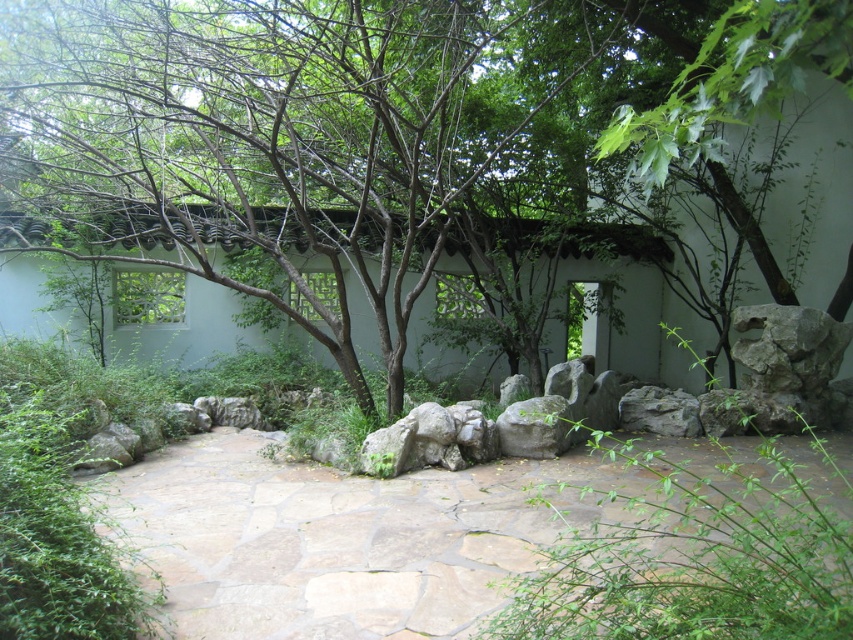
Does green leafy tree at center have a lesser width compared to gray rough rock at right?

Incorrect, green leafy tree at center's width is not less than gray rough rock at right's.

Does green leafy tree at center have a smaller size compared to gray rough rock at right?

No.

You are a GUI agent. You are given a task and a screenshot of the screen. Output one action in this format:
    pyautogui.click(x=<x>, y=<y>)
    Task: Click on the green leafy tree at center
    This screenshot has width=853, height=640.
    Given the screenshot: What is the action you would take?
    pyautogui.click(x=277, y=131)

You are a GUI agent. You are given a task and a screenshot of the screen. Output one action in this format:
    pyautogui.click(x=<x>, y=<y>)
    Task: Click on the green leafy tree at center
    The height and width of the screenshot is (640, 853).
    Given the screenshot: What is the action you would take?
    (277, 131)

Can you confirm if natural stone path at center is positioned below gray rough rock at center?

Yes.

Does natural stone path at center have a lesser height compared to gray rough rock at center?

Indeed, natural stone path at center has a lesser height compared to gray rough rock at center.

Is point (289, 502) closer to camera compared to point (621, 420)?

Yes, it is.

Image resolution: width=853 pixels, height=640 pixels. In order to click on natural stone path at center in this screenshot , I will do (347, 536).

In the scene shown: Does natural stone path at center have a greater height compared to gray rough stone at center?

No.

Can you confirm if natural stone path at center is positioned to the left of gray rough stone at center?

Yes, natural stone path at center is to the left of gray rough stone at center.

The width and height of the screenshot is (853, 640). What do you see at coordinates (347, 536) in the screenshot?
I see `natural stone path at center` at bounding box center [347, 536].

Locate an element on the screen. The image size is (853, 640). natural stone path at center is located at coordinates pyautogui.click(x=347, y=536).